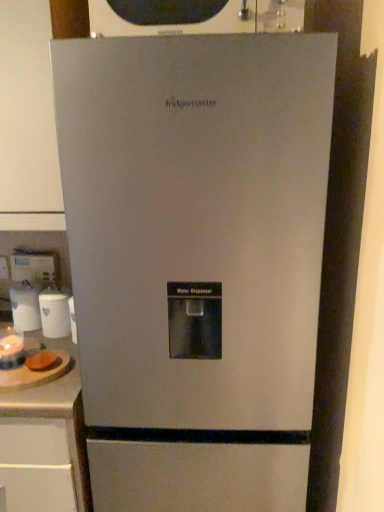
Question: Considering the relative sizes of white glossy water dispenser at center, which is the 3th appliance in front-to-back order, and brown bread at left in the image provided, is white glossy water dispenser at center, which is the 3th appliance in front-to-back order, bigger than brown bread at left?

Choices:
 (A) yes
 (B) no

Answer: (A)

Question: Can you confirm if white glossy water dispenser at center, which is the 3th appliance in front-to-back order, is taller than brown bread at left?

Choices:
 (A) yes
 (B) no

Answer: (A)

Question: Is white glossy water dispenser at center, acting as the 1th appliance starting from the back, shorter than brown bread at left?

Choices:
 (A) yes
 (B) no

Answer: (B)

Question: Would you consider white glossy water dispenser at center, which is the 3th appliance in front-to-back order, to be distant from brown bread at left?

Choices:
 (A) no
 (B) yes

Answer: (A)

Question: From the image's perspective, does white glossy water dispenser at center, which is the 3th appliance in front-to-back order, appear higher than brown bread at left?

Choices:
 (A) no
 (B) yes

Answer: (B)

Question: Is point (13, 359) positioned closer to the camera than point (16, 291)?

Choices:
 (A) closer
 (B) farther

Answer: (A)

Question: Visually, is matte glass candle at lower left, which is the 1th appliance from front to back, positioned to the left or to the right of white glossy water dispenser at center, acting as the 1th appliance starting from the back?

Choices:
 (A) left
 (B) right

Answer: (B)

Question: Is matte glass candle at lower left, which appears as the third appliance when viewed from the back, bigger or smaller than white glossy water dispenser at center, which is the 3th appliance in front-to-back order?

Choices:
 (A) big
 (B) small

Answer: (B)

Question: Relative to white glossy water dispenser at center, which is the 3th appliance in front-to-back order, is matte glass candle at lower left, which appears as the third appliance when viewed from the back, in front or behind?

Choices:
 (A) behind
 (B) front

Answer: (B)

Question: Based on their positions, is wooden cutting board at lower left located to the left or right of brown bread at left?

Choices:
 (A) left
 (B) right

Answer: (A)

Question: Looking at the image, does wooden cutting board at lower left seem bigger or smaller compared to brown bread at left?

Choices:
 (A) big
 (B) small

Answer: (A)

Question: Considering their positions, is wooden cutting board at lower left located in front of or behind brown bread at left?

Choices:
 (A) behind
 (B) front

Answer: (B)

Question: Is point (54, 343) closer or farther from the camera than point (56, 365)?

Choices:
 (A) closer
 (B) farther

Answer: (B)

Question: From the image's perspective, is satin silver refrigerator at center positioned above or below white glossy canister at left, acting as the second appliance starting from the back?

Choices:
 (A) above
 (B) below

Answer: (B)

Question: Is satin silver refrigerator at center bigger or smaller than white glossy canister at left, acting as the second appliance starting from the back?

Choices:
 (A) small
 (B) big

Answer: (B)